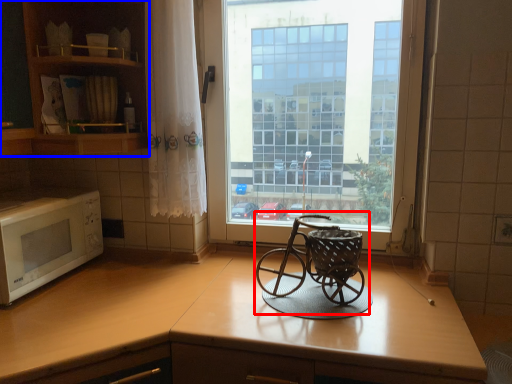
Question: Which of the following is the closest to the observer, baby carriage (highlighted by a red box) or cabinetry (highlighted by a blue box)?

Choices:
 (A) baby carriage
 (B) cabinetry

Answer: (A)